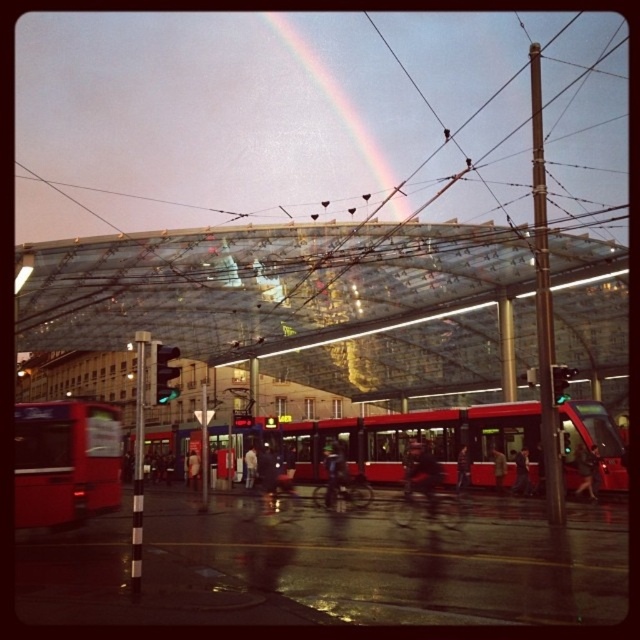
You are standing at the tram station and want to locate the transparent glass railway station at center. According to the coordinates provided, where exactly is it positioned?

The transparent glass railway station at center is located at coordinates point (305, 429).

You are standing at the tram station depicted in the image. There is a transparent glass railway station at center marked by point (305, 429). Where would you look to find the transparent glass railway station at center?

The transparent glass railway station at center is located at the coordinates point (305, 429).